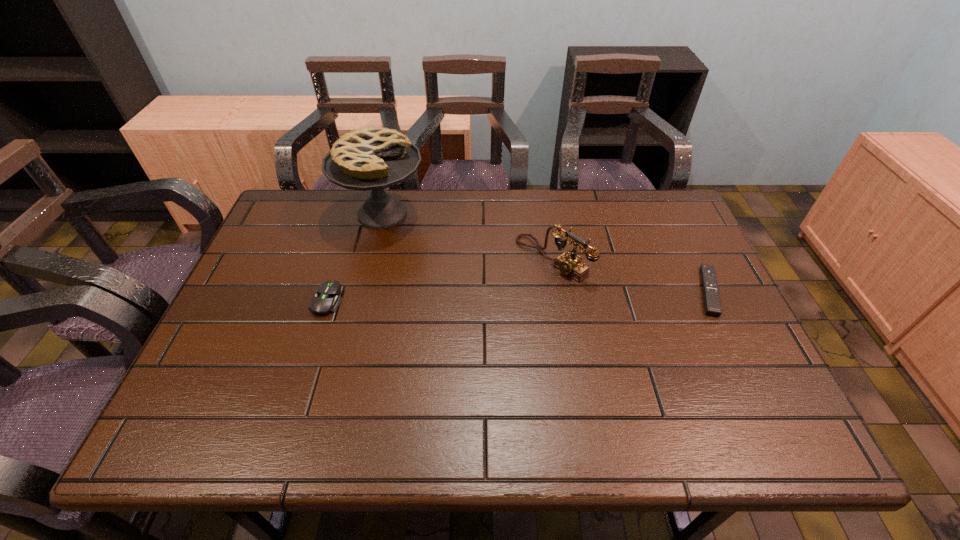
At what (x,y) coordinates should I click in order to perform the action: click on free space located 0.230m on the front-facing side of the second object from right to left. Please return your answer as a coordinate pair (x, y). The height and width of the screenshot is (540, 960). Looking at the image, I should click on (465, 322).

The width and height of the screenshot is (960, 540). In order to click on blank space located on the cut side of the tallest object in this screenshot , I will do `click(431, 248)`.

Where is `free space located on the cut side of the tallest object`? The width and height of the screenshot is (960, 540). free space located on the cut side of the tallest object is located at coordinates (499, 298).

Locate an element on the screen. The width and height of the screenshot is (960, 540). vacant space located on the cut side of the tallest object is located at coordinates (486, 288).

Identify the location of telephone situated at the far edge. (569, 264).

Image resolution: width=960 pixels, height=540 pixels. Find the location of `pie that is at the far edge`. pie that is at the far edge is located at coordinates (373, 158).

Identify the location of object positioned at the right edge. (712, 304).

The width and height of the screenshot is (960, 540). Find the location of `free space at the far edge`. free space at the far edge is located at coordinates (527, 227).

You are a GUI agent. You are given a task and a screenshot of the screen. Output one action in this format:
    pyautogui.click(x=<x>, y=<y>)
    Task: Click on the free space at the near edge of the desktop
    This screenshot has height=540, width=960.
    Given the screenshot: What is the action you would take?
    pyautogui.click(x=307, y=380)

The width and height of the screenshot is (960, 540). In order to click on vacant space at the left edge of the desktop in this screenshot , I will do `click(236, 332)`.